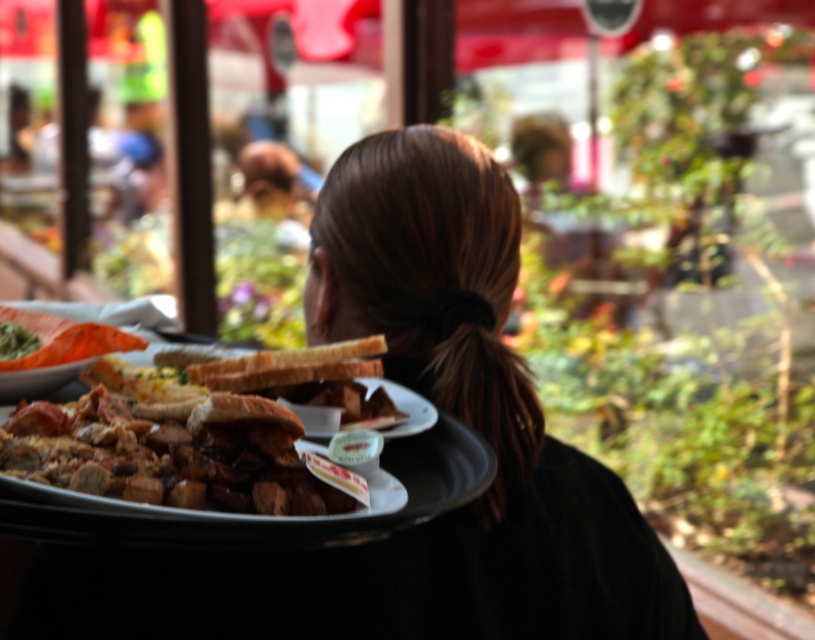
Is point (60, 346) positioned in front of point (16, 355)?

Yes, it is.

Where is `orange matte plate at upper left`? The width and height of the screenshot is (815, 640). orange matte plate at upper left is located at coordinates 64,339.

Find the location of `orange matte plate at upper left`. orange matte plate at upper left is located at coordinates (64, 339).

Between golden brown bread at center and orange matte plate at upper left, which one has more height?

golden brown bread at center is taller.

Between point (109, 433) and point (82, 353), which one is positioned in front?

Point (109, 433) is in front.

At what (x,y) coordinates should I click in order to perform the action: click on golden brown bread at center. Please return your answer as a coordinate pair (x, y). Image resolution: width=815 pixels, height=640 pixels. Looking at the image, I should click on click(166, 445).

Where is `golden brown bread at center`? The image size is (815, 640). golden brown bread at center is located at coordinates (166, 445).

Is brown hair at center below orange matte plate at upper left?

Correct, brown hair at center is located below orange matte plate at upper left.

Is brown hair at center further to camera compared to orange matte plate at upper left?

Yes, brown hair at center is further from the viewer.

Between point (434, 358) and point (108, 332), which one is positioned in front?

Positioned in front is point (108, 332).

I want to click on brown hair at center, so click(x=472, y=413).